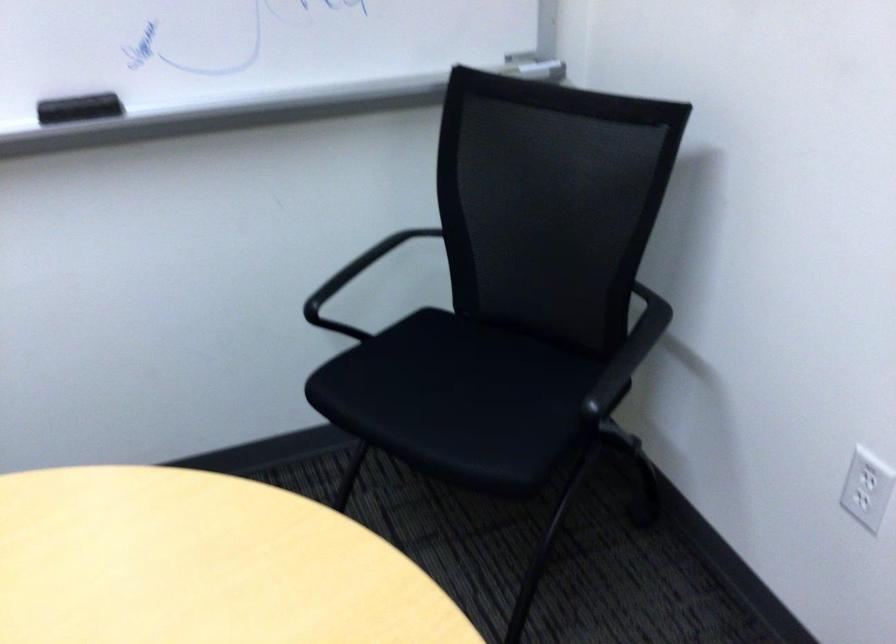
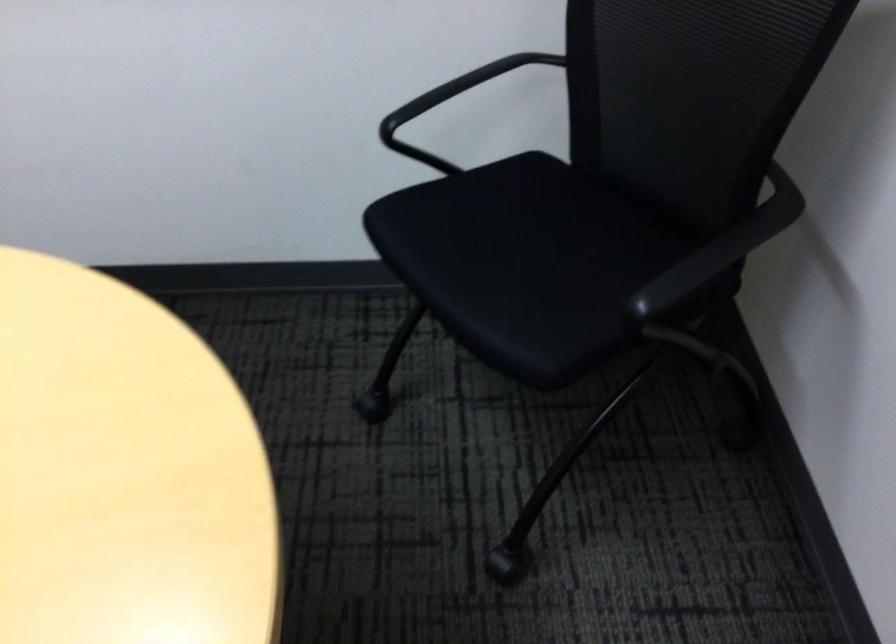
Where in the second image is the point corresponding to pixel 618 366 from the first image?

(702, 268)